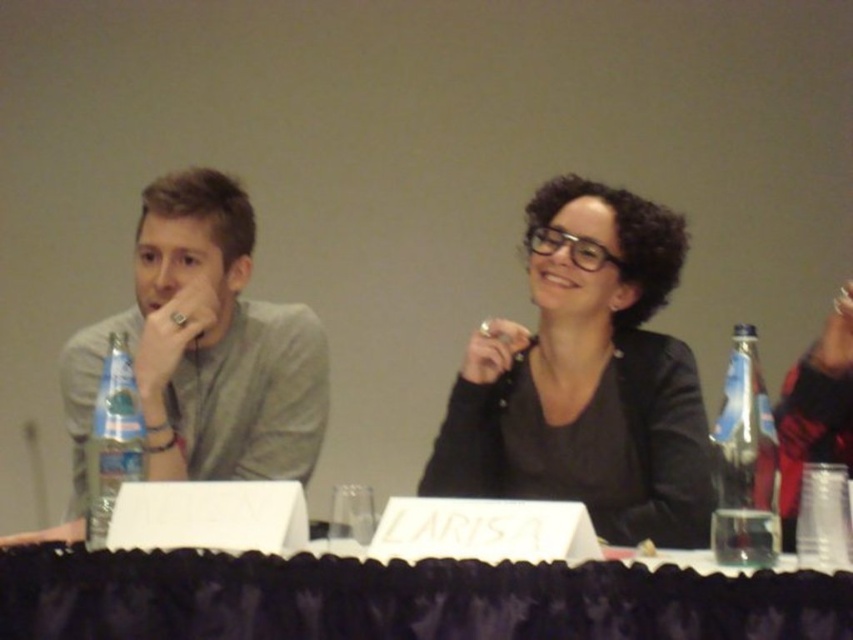
Who is more forward, [712,573] or [165,340]?

Point [712,573] is more forward.

Is black satin tablecloth at lower center closer to camera compared to matte gray shirt at left?

Yes, black satin tablecloth at lower center is in front of matte gray shirt at left.

The width and height of the screenshot is (853, 640). What do you see at coordinates (399, 598) in the screenshot?
I see `black satin tablecloth at lower center` at bounding box center [399, 598].

This screenshot has width=853, height=640. I want to click on black satin tablecloth at lower center, so click(399, 598).

Does black matte jacket at center have a smaller size compared to clear plastic bottle at right?

No, black matte jacket at center is not smaller than clear plastic bottle at right.

Between black matte jacket at center and clear plastic bottle at right, which one is positioned higher?

black matte jacket at center is higher up.

Identify the location of black matte jacket at center. This screenshot has width=853, height=640. (587, 381).

At what (x,y) coordinates should I click in order to perform the action: click on black matte jacket at center. Please return your answer as a coordinate pair (x, y). Image resolution: width=853 pixels, height=640 pixels. Looking at the image, I should click on (587, 381).

Is point (759, 436) positioned in front of point (106, 374)?

That is True.

Is clear plastic bottle at right wider than clear plastic bottle at left?

Yes, clear plastic bottle at right is wider than clear plastic bottle at left.

Does point (730, 397) lie in front of point (143, 440)?

Yes, point (730, 397) is in front of point (143, 440).

The height and width of the screenshot is (640, 853). Find the location of `clear plastic bottle at right`. clear plastic bottle at right is located at coordinates (746, 464).